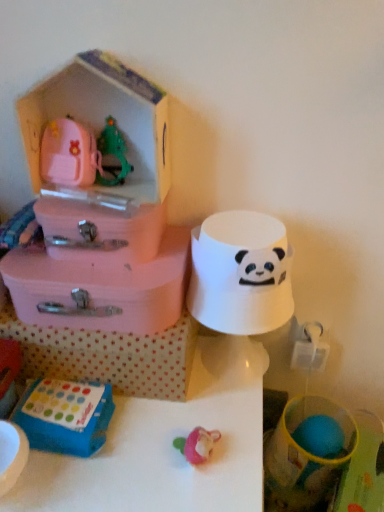
This screenshot has height=512, width=384. In order to click on free point to the right of blue plastic toy at lower left, placed as the first toy when sorted from left to right in this screenshot , I will do `click(166, 432)`.